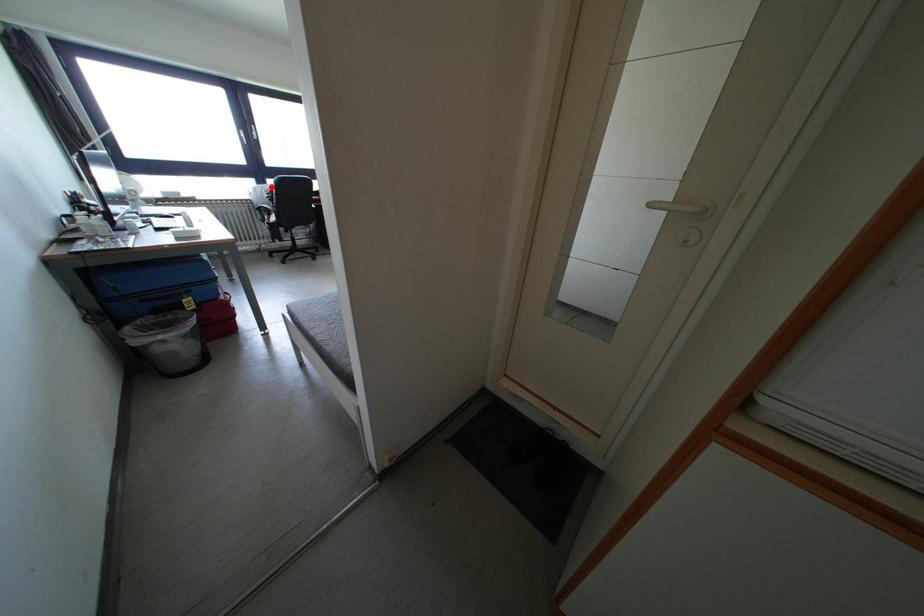
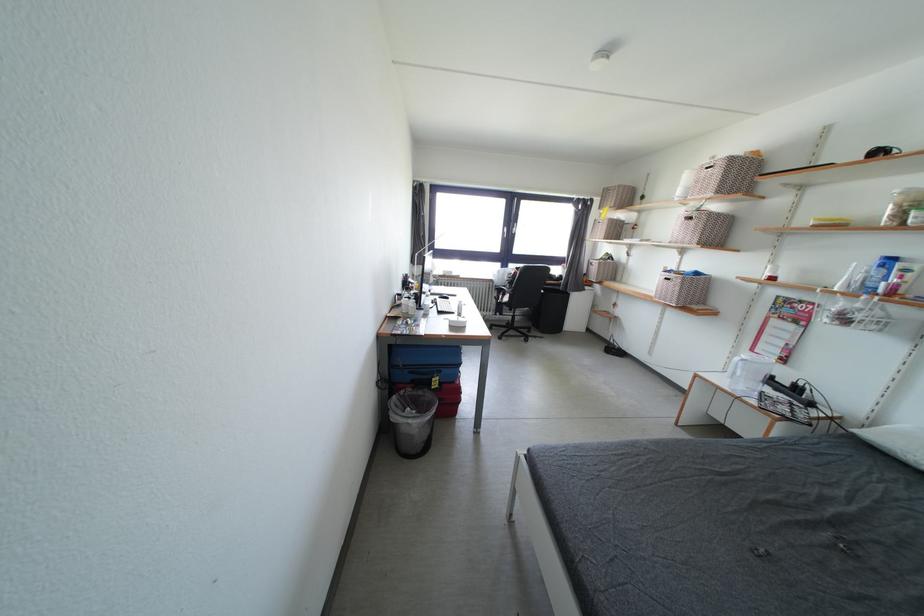
Locate, in the second image, the point that corresponds to the highlighted location in the first image.

(514, 270)